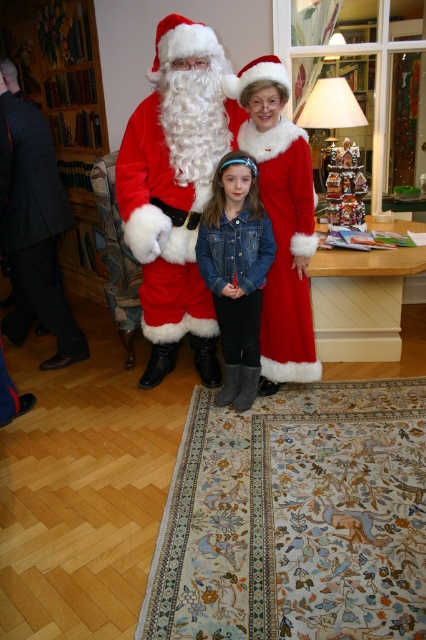
You are standing at the point labeled as point (236, 365) and want to move towards the point labeled as point (275, 204). Based on the scene description, will you be moving forward or backward?

Since point (275, 204) is in front of point (236, 365), moving towards it would mean moving forward.

You are a photographer trying to capture a group photo of the dark gray suit at left and the denim jacket at center. Based on their positions, which one should you focus on first to ensure they are both in focus?

The dark gray suit at left is above the denim jacket at center, so you should focus on the dark gray suit at left first to ensure both are in focus.

You are standing in the festive scene and want to place a small gift exactly halfway between the two points labeled point (28,161) and point (224,336). Will the gift be closer to the camera or further away compared to the point that is further from the camera?

The gift placed halfway between point (28,161) and point (224,336) will be closer to the camera than the point that is further away, which is point (224,336). Since point (28,161) is closer to the camera, the midpoint will still be nearer than the farther point.